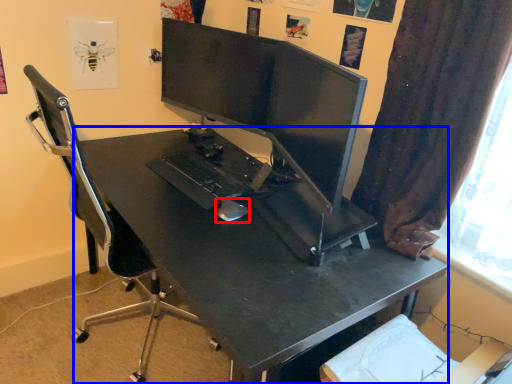
Question: Which point is closer to the camera, mouse (highlighted by a red box) or desk (highlighted by a blue box)?

Choices:
 (A) mouse
 (B) desk

Answer: (B)